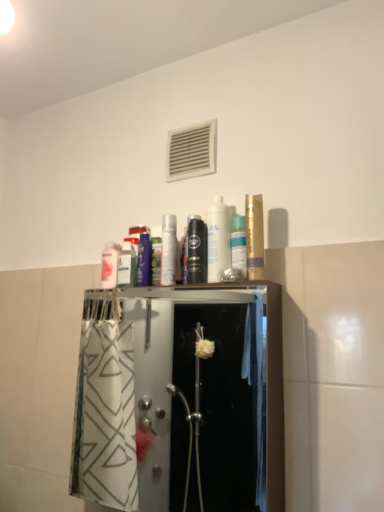
Question: In which direction should I rotate to look at silver metallic can at center, placed as the second toiletry when sorted from left to right?

Choices:
 (A) left
 (B) right

Answer: (A)

Question: Is gold metallic can at upper right, which ranks as the 3th mouthwash in left-to-right order, inside white plastic vent at upper center?

Choices:
 (A) no
 (B) yes

Answer: (A)

Question: Is white plastic vent at upper center closer to camera compared to gold metallic can at upper right, which ranks as the 3th mouthwash in left-to-right order?

Choices:
 (A) yes
 (B) no

Answer: (B)

Question: From the image's perspective, is white plastic vent at upper center under gold metallic can at upper right, which ranks as the 3th mouthwash in left-to-right order?

Choices:
 (A) yes
 (B) no

Answer: (B)

Question: Does white plastic vent at upper center have a greater width compared to gold metallic can at upper right, which ranks as the 3th mouthwash in left-to-right order?

Choices:
 (A) no
 (B) yes

Answer: (A)

Question: Is white plastic vent at upper center located outside gold metallic can at upper right, which ranks as the first mouthwash in right-to-left order?

Choices:
 (A) yes
 (B) no

Answer: (A)

Question: Can you confirm if white plastic vent at upper center is bigger than gold metallic can at upper right, which ranks as the first mouthwash in right-to-left order?

Choices:
 (A) no
 (B) yes

Answer: (B)

Question: Does gold metallic can at upper right, which ranks as the first mouthwash in right-to-left order, have a smaller size compared to black glossy mouthwash at center, which is the second mouthwash from left to right?

Choices:
 (A) no
 (B) yes

Answer: (A)

Question: Does gold metallic can at upper right, which ranks as the first mouthwash in right-to-left order, have a larger size compared to black glossy mouthwash at center, which ranks as the second mouthwash in right-to-left order?

Choices:
 (A) no
 (B) yes

Answer: (B)

Question: Is gold metallic can at upper right, which ranks as the 3th mouthwash in left-to-right order, in contact with black glossy mouthwash at center, which ranks as the second mouthwash in right-to-left order?

Choices:
 (A) yes
 (B) no

Answer: (B)

Question: Is gold metallic can at upper right, which ranks as the first mouthwash in right-to-left order, looking in the opposite direction of black glossy mouthwash at center, which ranks as the second mouthwash in right-to-left order?

Choices:
 (A) no
 (B) yes

Answer: (A)

Question: Is gold metallic can at upper right, which ranks as the first mouthwash in right-to-left order, outside of black glossy mouthwash at center, which is the second mouthwash from left to right?

Choices:
 (A) no
 (B) yes

Answer: (B)

Question: From the image's perspective, is gold metallic can at upper right, which ranks as the 3th mouthwash in left-to-right order, on top of black glossy mouthwash at center, which ranks as the second mouthwash in right-to-left order?

Choices:
 (A) no
 (B) yes

Answer: (B)

Question: Does matte white canister at center, arranged as the 3th toiletry when viewed from the left, contain gold metallic can at upper right, which ranks as the 3th mouthwash in left-to-right order?

Choices:
 (A) no
 (B) yes

Answer: (A)